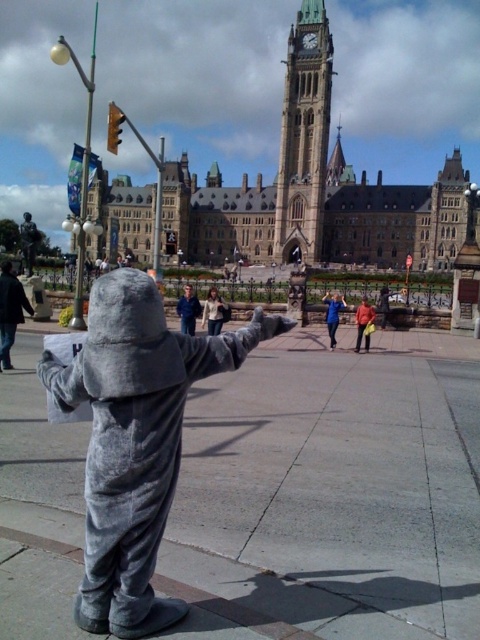
Question: Which point is farther from the camera taking this photo?

Choices:
 (A) coord(181,323)
 (B) coord(33,227)
 (C) coord(386,289)

Answer: (B)

Question: Does light brown leather jacket at center come behind matte gray costume at center?

Choices:
 (A) yes
 (B) no

Answer: (B)

Question: Which point is farther from the camera taking this photo?

Choices:
 (A) (316, 166)
 (B) (7, 342)
 (C) (381, 292)
 (D) (206, 298)

Answer: (D)

Question: Is gray fabric costume at center thinner than blue fabric person at center?

Choices:
 (A) yes
 (B) no

Answer: (B)

Question: Which object is closer to the camera taking this photo?

Choices:
 (A) dark gray plush costume at left
 (B) blue fabric person at center

Answer: (A)

Question: Is gold stone clock tower at upper center above dark gray plush costume at left?

Choices:
 (A) no
 (B) yes

Answer: (B)